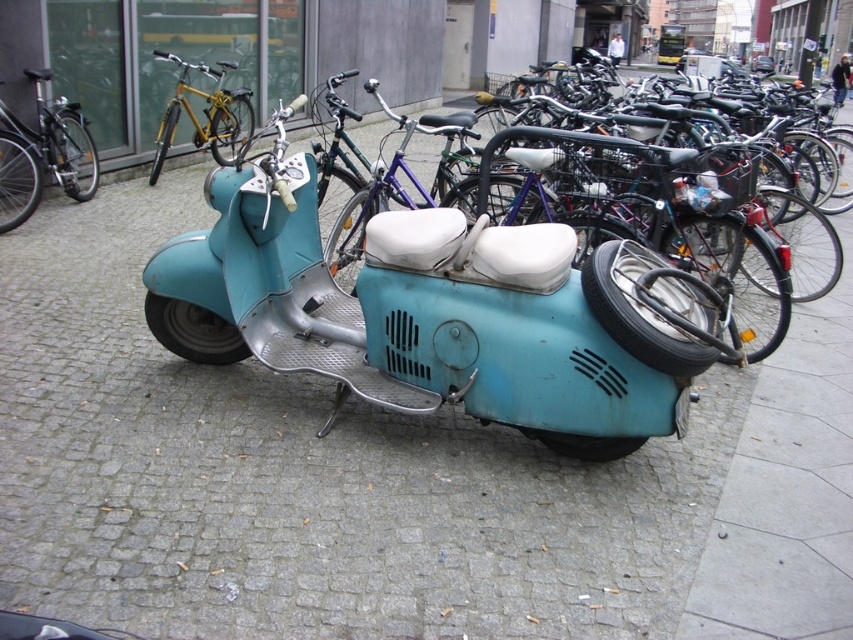
You are a delivery person who needs to move the shiny silver bicycle at left to access the matte blue scooter at center. Can you move the bicycle without moving the scooter?

The matte blue scooter at center is in front of the shiny silver bicycle at left, so you would need to move the scooter first to access the bicycle behind it.